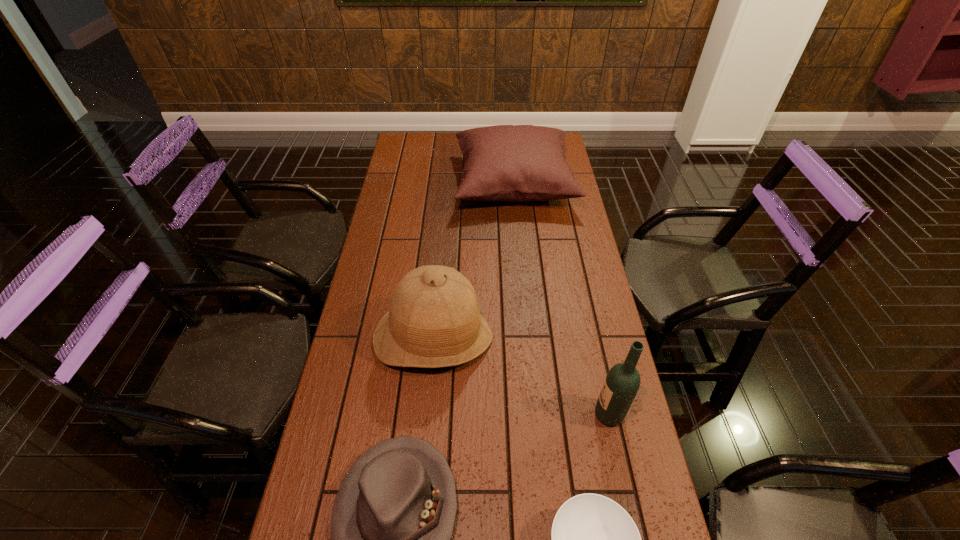
The width and height of the screenshot is (960, 540). What are the coordinates of `free space between the wine bottle and the taller hat` in the screenshot? It's located at (521, 376).

Identify the location of vacant area between the third tallest object and the taller hat. (473, 261).

I want to click on vacant space in between the third nearest object and the third shortest object, so click(562, 299).

The image size is (960, 540). I want to click on the third closest object relative to the third farthest object, so click(392, 522).

Locate which object is the third closest to the cushion. Please provide its 2D coordinates. Your answer should be formatted as a tuple, i.e. [(x, y)], where the tuple contains the x and y coordinates of a point satisfying the conditions above.

[(392, 522)]